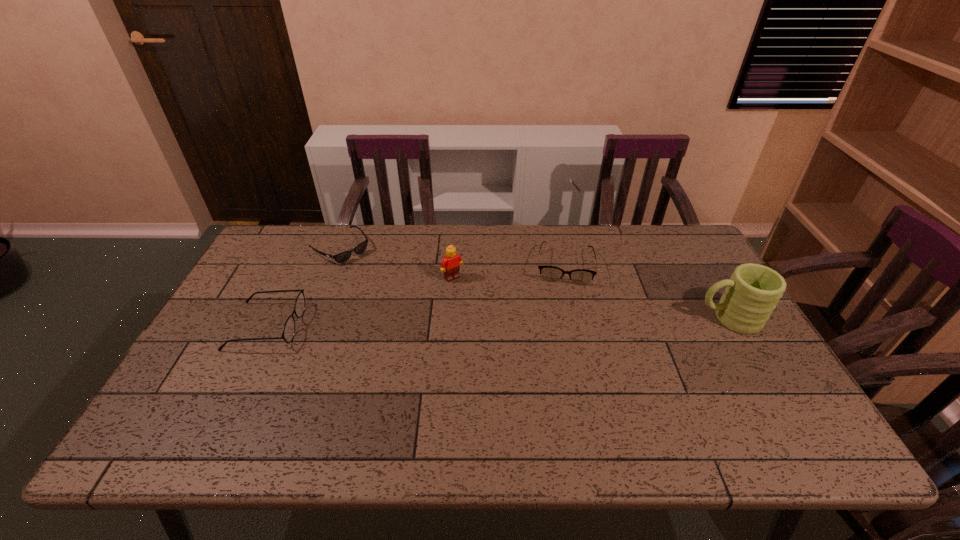
This screenshot has height=540, width=960. Find the location of `vacant space located 0.160m on the side of the mug with the handle`. vacant space located 0.160m on the side of the mug with the handle is located at coordinates (639, 319).

In order to click on vacant space located on the side of the mug with the handle in this screenshot , I will do `click(667, 319)`.

Identify the location of free space located on the face of the Lego. (488, 316).

Find the location of `vacant space located 0.320m on the face of the Lego`. vacant space located 0.320m on the face of the Lego is located at coordinates (517, 352).

I want to click on vacant space situated on the face of the Lego, so click(x=507, y=339).

I want to click on vacant space situated on the face of the farther spectacles, so click(x=564, y=298).

Where is `free spot located on the face of the farther spectacles`? free spot located on the face of the farther spectacles is located at coordinates (562, 341).

Find the location of `free region located on the face of the farther spectacles`. free region located on the face of the farther spectacles is located at coordinates click(x=564, y=300).

Where is `vacant region located on the front-facing side of the shortest object`? This screenshot has height=540, width=960. vacant region located on the front-facing side of the shortest object is located at coordinates (405, 301).

Where is `free space located 0.130m on the front-facing side of the shortest object`? free space located 0.130m on the front-facing side of the shortest object is located at coordinates (379, 280).